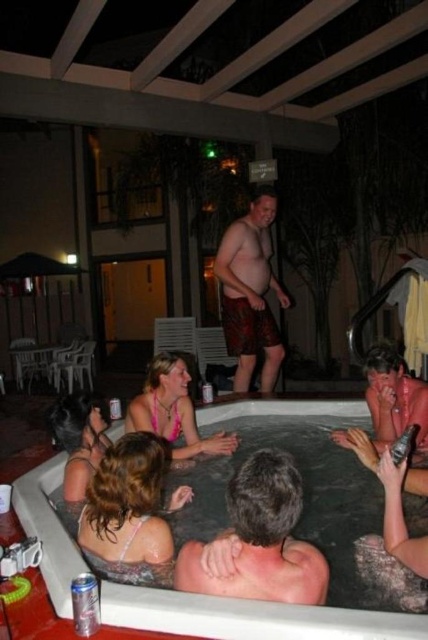
You are planning to place the metallic silver can at lower right on the edge of the white plastic hot tub at lower center. Based on their sizes, do you think the can will fit without hanging over the edge?

The white plastic hot tub at lower center might be wider than metallic silver can at lower right, so there is a possibility that the can will fit without hanging over the edge, but the exact fit depends on the specific dimensions.

You are a guest at the resort and want to place a metallic silver can at lower right on the edge of the white plastic hot tub at lower center. Is the can currently positioned correctly?

The white plastic hot tub at lower center is positioned on the left side of the metallic silver can at lower right, so the can is currently on the right side of the hot tub. To place it on the edge of the hot tub, you should move it to the left side of the hot tub.